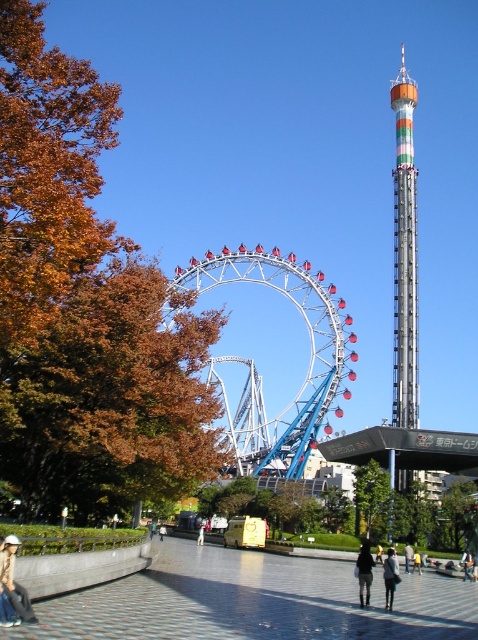
Which is below, striped metal tower at upper right or dark blue jeans at center?

dark blue jeans at center is below.

Which is behind, point (401, 49) or point (364, 579)?

The point (401, 49) is more distant.

At what (x,y) coordinates should I click in order to perform the action: click on striped metal tower at upper right. Please return your answer as a coordinate pair (x, y). Looking at the image, I should click on (404, 256).

Does light brown leather jacket at lower left come in front of light brown leather jacket at center?

Yes, it is in front of light brown leather jacket at center.

Can you confirm if light brown leather jacket at lower left is taller than light brown leather jacket at center?

Yes.

Who is more forward, (12, 557) or (406, 564)?

Point (12, 557) is in front.

In order to click on light brown leather jacket at lower left in this screenshot , I will do `click(13, 580)`.

The image size is (478, 640). Identify the location of dark blue jeans at center. (365, 572).

Between point (357, 561) and point (408, 557), which one is positioned behind?

Point (408, 557)

Based on the photo, measure the distance between point (369, 563) and camera.

Point (369, 563) is 361.15 feet from camera.

Identify the location of dark blue jeans at center. This screenshot has width=478, height=640. (365, 572).